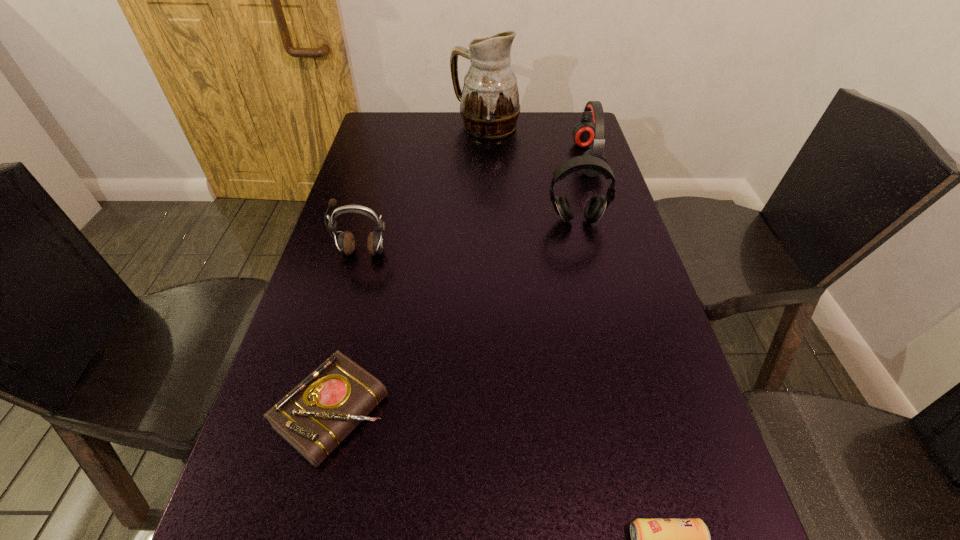
Where is `free region that satisfies the following two spatial constraints: 1. on the ear pads of the leftmost earphone; 2. on the left side of the fifth farthest object`? This screenshot has width=960, height=540. free region that satisfies the following two spatial constraints: 1. on the ear pads of the leftmost earphone; 2. on the left side of the fifth farthest object is located at coordinates (318, 413).